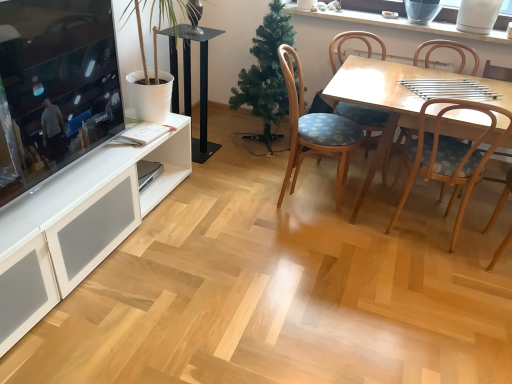
Question: Is black glass speaker at center thinner than wooden chair with blue cushion at center-right, the 3th chair viewed from the left?

Choices:
 (A) no
 (B) yes

Answer: (B)

Question: From the image's perspective, is black glass speaker at center on top of wooden chair with blue cushion at center-right, the 3th chair viewed from the left?

Choices:
 (A) yes
 (B) no

Answer: (A)

Question: Is black glass speaker at center wider than wooden chair with blue cushion at center-right, which is the second chair from right to left?

Choices:
 (A) no
 (B) yes

Answer: (A)

Question: From a real-world perspective, is black glass speaker at center below wooden chair with blue cushion at center-right, the 3th chair viewed from the left?

Choices:
 (A) yes
 (B) no

Answer: (A)

Question: Can you confirm if black glass speaker at center is smaller than wooden chair with blue cushion at center-right, which is the second chair from right to left?

Choices:
 (A) no
 (B) yes

Answer: (B)

Question: Considering the positions of wooden chair with floral cushion at center, which is the 2th chair in left-to-right order, and white ceramic vase at upper center in the image, is wooden chair with floral cushion at center, which is the 2th chair in left-to-right order, taller or shorter than white ceramic vase at upper center?

Choices:
 (A) tall
 (B) short

Answer: (A)

Question: Is wooden chair with floral cushion at center, which ranks as the 3th chair in right-to-left order, bigger or smaller than white ceramic vase at upper center?

Choices:
 (A) big
 (B) small

Answer: (A)

Question: Would you say wooden chair with floral cushion at center, which is the 2th chair in left-to-right order, is to the left or to the right of white ceramic vase at upper center in the picture?

Choices:
 (A) left
 (B) right

Answer: (A)

Question: From the image's perspective, is wooden chair with floral cushion at center, which is the 2th chair in left-to-right order, located above or below white ceramic vase at upper center?

Choices:
 (A) above
 (B) below

Answer: (B)

Question: Looking at their shapes, would you say light wood table at center is wider or thinner than wooden chair with floral cushion at center, the 1th chair when ordered from right to left?

Choices:
 (A) wide
 (B) thin

Answer: (A)

Question: Is light wood table at center bigger or smaller than wooden chair with floral cushion at center, the 1th chair when ordered from right to left?

Choices:
 (A) big
 (B) small

Answer: (A)

Question: From a real-world perspective, relative to wooden chair with floral cushion at center, the fourth chair positioned from the left, is light wood table at center vertically above or below?

Choices:
 (A) below
 (B) above

Answer: (A)

Question: Is light wood table at center taller or shorter than wooden chair with floral cushion at center, the 1th chair when ordered from right to left?

Choices:
 (A) tall
 (B) short

Answer: (B)

Question: Is green matte christmas tree at center taller or shorter than wooden chair with floral cushion at center, which is the 2th chair in left-to-right order?

Choices:
 (A) short
 (B) tall

Answer: (B)

Question: From the image's perspective, relative to wooden chair with floral cushion at center, which ranks as the 3th chair in right-to-left order, is green matte christmas tree at center above or below?

Choices:
 (A) above
 (B) below

Answer: (A)